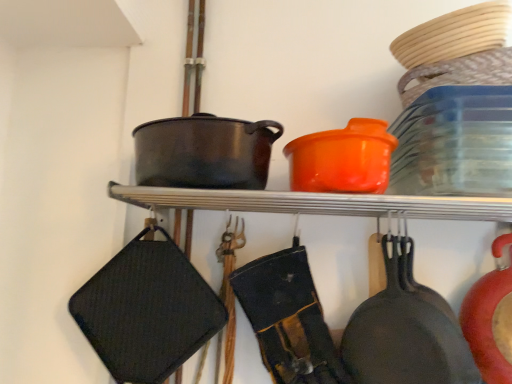
Question: From a real-world perspective, is orange matte pot at upper center located beneath matte black frying pan at lower right?

Choices:
 (A) no
 (B) yes

Answer: (A)

Question: Are orange matte pot at upper center and matte black frying pan at lower right beside each other?

Choices:
 (A) no
 (B) yes

Answer: (A)

Question: Considering the relative sizes of orange matte pot at upper center and matte black frying pan at lower right in the image provided, is orange matte pot at upper center taller than matte black frying pan at lower right?

Choices:
 (A) yes
 (B) no

Answer: (B)

Question: Could you tell me if orange matte pot at upper center is turned towards matte black frying pan at lower right?

Choices:
 (A) no
 (B) yes

Answer: (A)

Question: Is orange matte pot at upper center in front of matte black frying pan at lower right?

Choices:
 (A) yes
 (B) no

Answer: (A)

Question: Is orange matte pot at upper center to the left or to the right of matte black frying pan at lower right in the image?

Choices:
 (A) right
 (B) left

Answer: (B)

Question: Considering the positions of orange matte pot at upper center and matte black frying pan at lower right in the image, is orange matte pot at upper center bigger or smaller than matte black frying pan at lower right?

Choices:
 (A) big
 (B) small

Answer: (B)

Question: From their relative heights in the image, would you say orange matte pot at upper center is taller or shorter than matte black frying pan at lower right?

Choices:
 (A) tall
 (B) short

Answer: (B)

Question: Is orange matte pot at upper center wider or thinner than matte black frying pan at lower right?

Choices:
 (A) thin
 (B) wide

Answer: (B)

Question: In the image, is matte black frying pan at lower right positioned in front of or behind orange plastic pot at upper center?

Choices:
 (A) front
 (B) behind

Answer: (B)

Question: In the image, is matte black frying pan at lower right on the left side or the right side of orange plastic pot at upper center?

Choices:
 (A) right
 (B) left

Answer: (A)

Question: From their relative heights in the image, would you say matte black frying pan at lower right is taller or shorter than orange plastic pot at upper center?

Choices:
 (A) short
 (B) tall

Answer: (B)

Question: Is matte black frying pan at lower right bigger or smaller than orange plastic pot at upper center?

Choices:
 (A) small
 (B) big

Answer: (B)

Question: Is orange matte pot at upper center taller or shorter than orange plastic pot at upper center?

Choices:
 (A) short
 (B) tall

Answer: (A)

Question: Do you think orange matte pot at upper center is within orange plastic pot at upper center, or outside of it?

Choices:
 (A) inside
 (B) outside

Answer: (B)